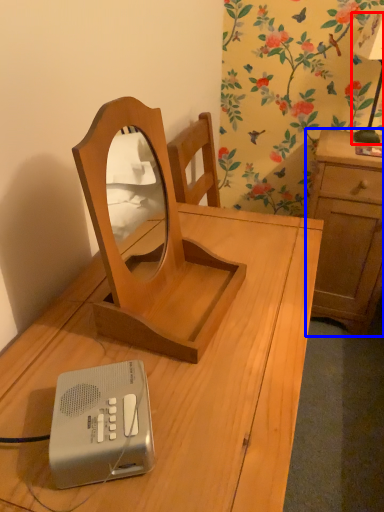
Question: Among these objects, which one is nearest to the camera, bedside lamp (highlighted by a red box) or cabinetry (highlighted by a blue box)?

Choices:
 (A) bedside lamp
 (B) cabinetry

Answer: (A)